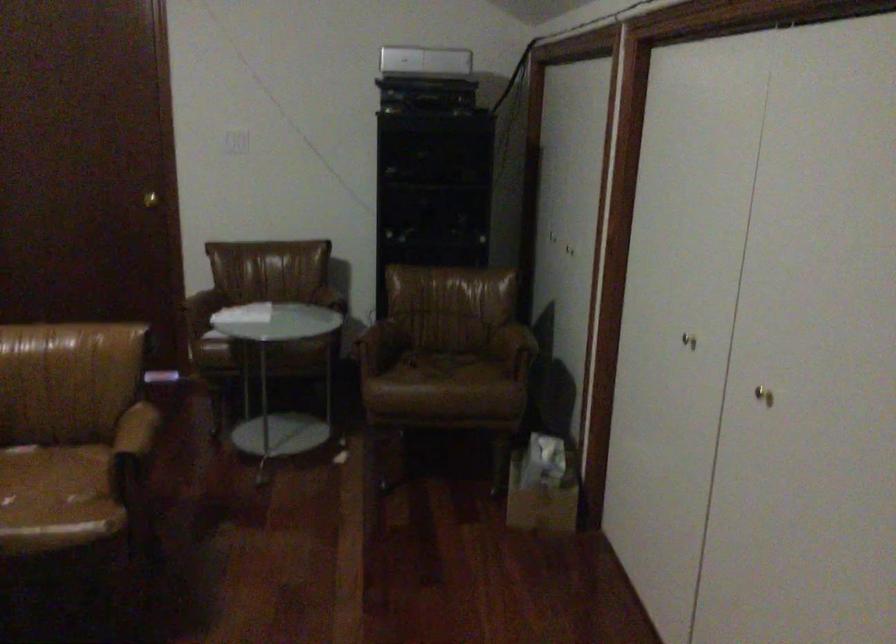
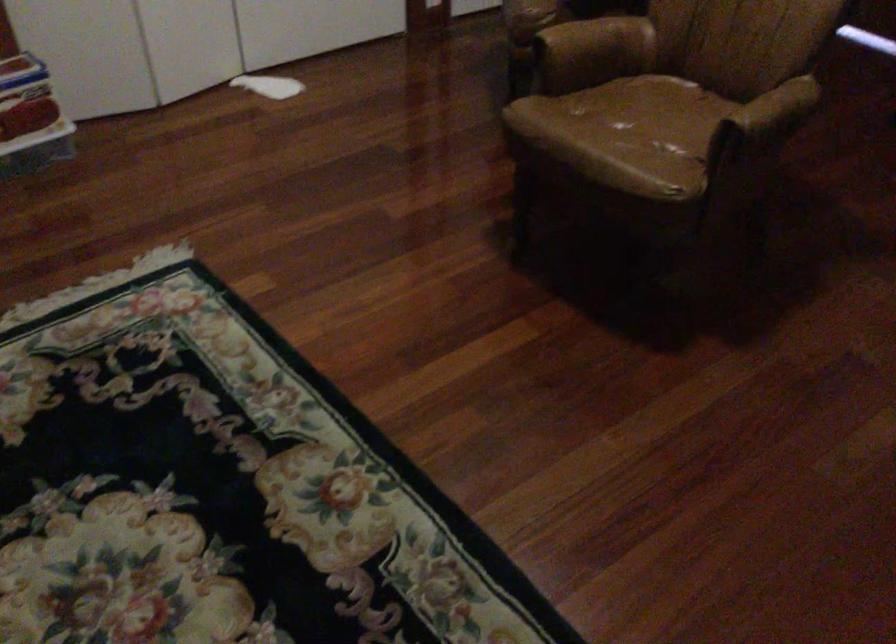
Where in the second image is the point corresponding to the point at 144,430 from the first image?

(776, 109)